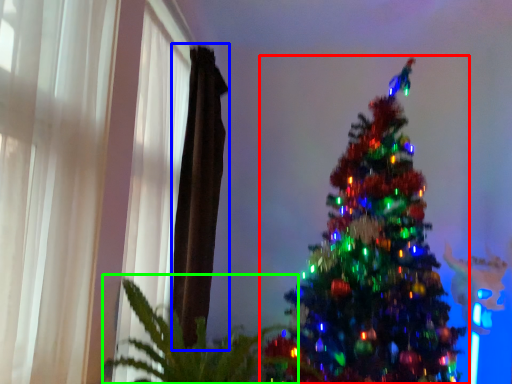
Question: Considering the real-world distances, which object is farthest from christmas tree (highlighted by a red box)? curtain (highlighted by a blue box) or plant (highlighted by a green box)?

Choices:
 (A) curtain
 (B) plant

Answer: (A)